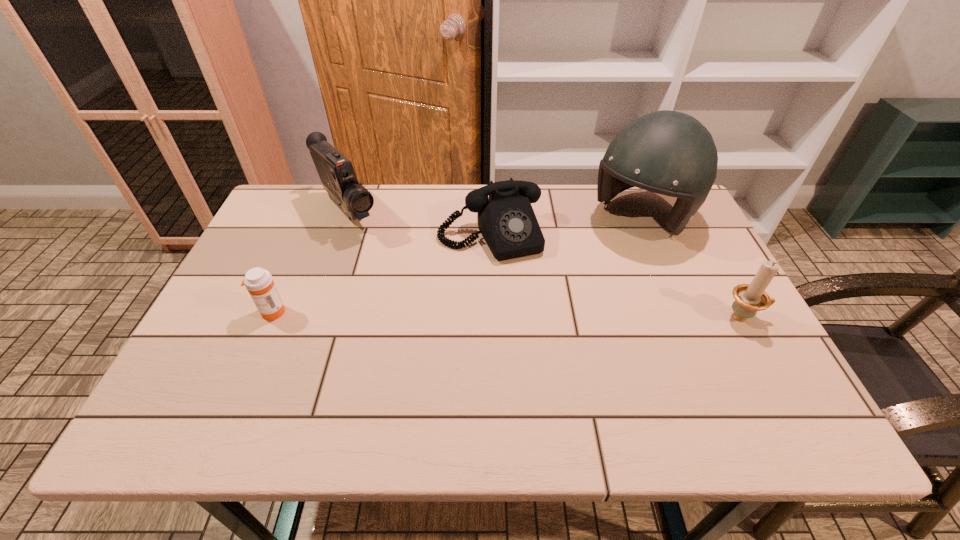
This screenshot has height=540, width=960. I want to click on medicine, so click(x=259, y=282).

Image resolution: width=960 pixels, height=540 pixels. I want to click on the third shortest object, so click(750, 298).

Where is `telephone`? telephone is located at coordinates pos(506,220).

The width and height of the screenshot is (960, 540). I want to click on football helmet, so click(671, 153).

This screenshot has height=540, width=960. What are the coordinates of `camcorder` in the screenshot? It's located at (336, 172).

Locate an element on the screen. free space located on the back of the medicine is located at coordinates (315, 213).

At what (x,y) coordinates should I click in order to perform the action: click on vacant space located on the dial of the telephone. Please return your answer as a coordinate pair (x, y). This screenshot has height=540, width=960. Looking at the image, I should click on (519, 294).

Where is `vacant position located on the dial of the telephone`? The width and height of the screenshot is (960, 540). vacant position located on the dial of the telephone is located at coordinates (555, 372).

At what (x,y) coordinates should I click in order to perform the action: click on free space located 0.070m on the dial of the telephone. Please return your answer as a coordinate pair (x, y). Looking at the image, I should click on click(x=513, y=280).

The image size is (960, 540). In order to click on free point located 0.400m at the face opening of the football helmet in this screenshot , I will do `click(533, 327)`.